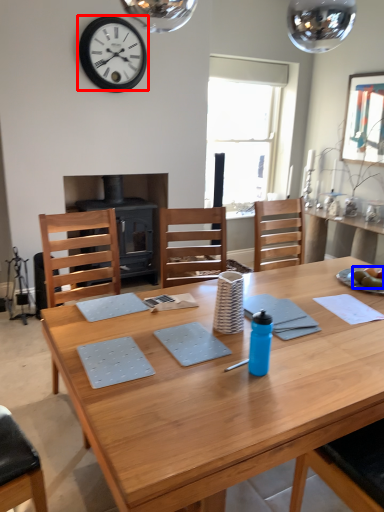
Question: Which object is further to the camera taking this photo, wall clock (highlighted by a red box) or food (highlighted by a blue box)?

Choices:
 (A) wall clock
 (B) food

Answer: (A)